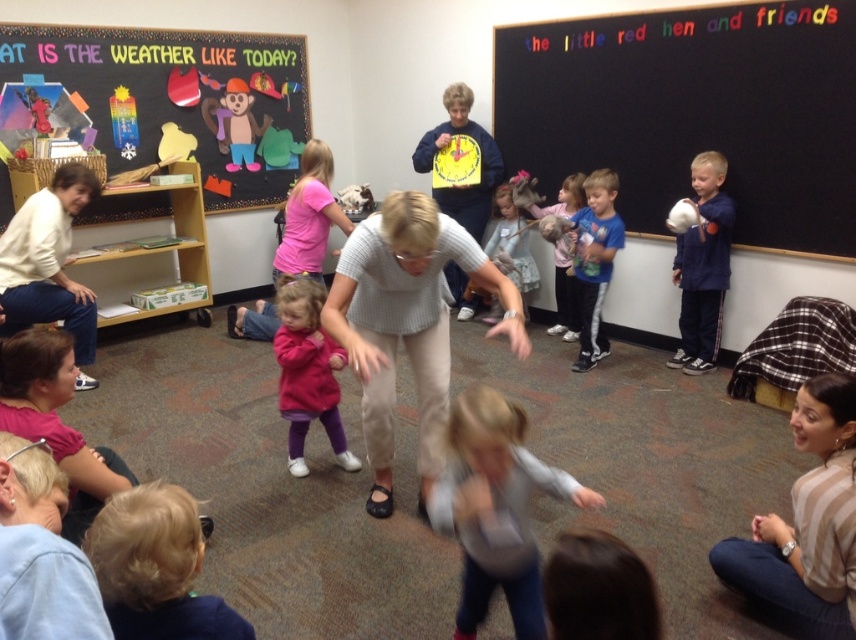
Does point (835, 456) come in front of point (688, 202)?

Yes, point (835, 456) is closer to viewer.

Between point (767, 572) and point (698, 216), which one is positioned in front?

Point (767, 572)

Find the location of a particular element. striped shirt at lower right is located at coordinates (806, 525).

This screenshot has height=640, width=856. Identify the location of striped shirt at lower right. (806, 525).

Which is more to the right, blue cotton shirt at center or matte pink sweater at center?

From the viewer's perspective, blue cotton shirt at center appears more on the right side.

Which of these two, blue cotton shirt at center or matte pink sweater at center, stands shorter?

Standing shorter between the two is matte pink sweater at center.

Locate an element on the screen. The height and width of the screenshot is (640, 856). blue cotton shirt at center is located at coordinates (593, 262).

Is blonde hair at lower left taller than pink fabric shirt at center?

No.

Can you confirm if blonde hair at lower left is bigger than pink fabric shirt at center?

Actually, blonde hair at lower left might be smaller than pink fabric shirt at center.

Which is behind, point (171, 492) or point (322, 144)?

Positioned behind is point (322, 144).

Locate an element on the screen. blonde hair at lower left is located at coordinates (156, 566).